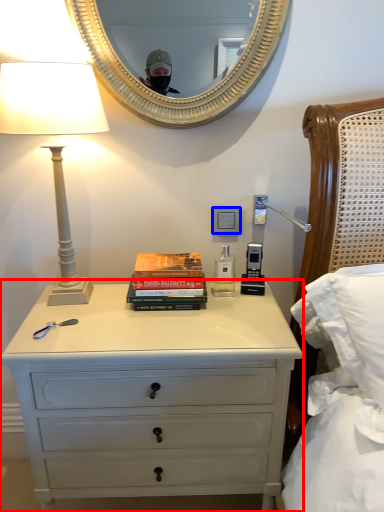
Question: Among these objects, which one is nearest to the camera, chest of drawers (highlighted by a red box) or power outlet (highlighted by a blue box)?

Choices:
 (A) chest of drawers
 (B) power outlet

Answer: (A)